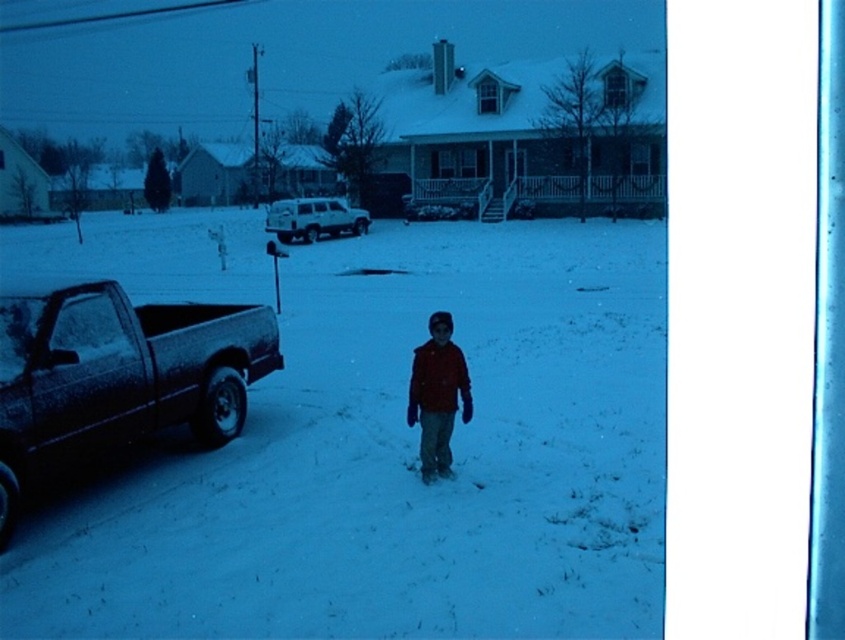
Question: Which of the following is the farthest from the observer?

Choices:
 (A) (295, 372)
 (B) (439, 417)

Answer: (A)

Question: Estimate the real-world distances between objects in this image. Which object is closer to the slightly glossy snow at center?

Choices:
 (A) matte red jacket at center
 (B) white matte suv at center
 (C) satin black pickup truck at lower left

Answer: (C)

Question: Considering the real-world distances, which object is farthest from the white matte suv at center?

Choices:
 (A) slightly glossy snow at center
 (B) satin black pickup truck at lower left

Answer: (B)

Question: Is satin black pickup truck at lower left to the left of matte red jacket at center from the viewer's perspective?

Choices:
 (A) yes
 (B) no

Answer: (A)

Question: Can you confirm if satin black pickup truck at lower left is positioned to the right of matte red jacket at center?

Choices:
 (A) no
 (B) yes

Answer: (A)

Question: Considering the relative positions of slightly glossy snow at center and satin black pickup truck at lower left in the image provided, where is slightly glossy snow at center located with respect to satin black pickup truck at lower left?

Choices:
 (A) above
 (B) below

Answer: (A)